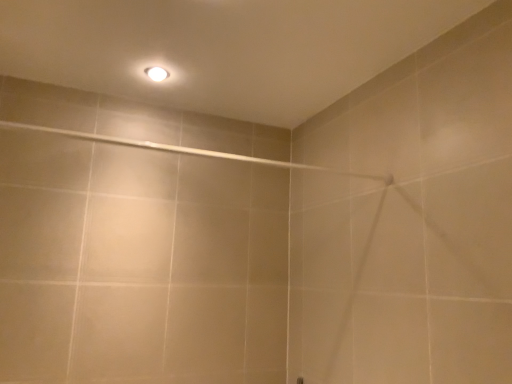
Question: Is white glossy light bulb at upper center closer to the viewer compared to beige ceramic shower at upper center?

Choices:
 (A) no
 (B) yes

Answer: (A)

Question: Considering the relative sizes of white glossy light bulb at upper center and beige ceramic shower at upper center in the image provided, is white glossy light bulb at upper center thinner than beige ceramic shower at upper center?

Choices:
 (A) yes
 (B) no

Answer: (B)

Question: Does white glossy light bulb at upper center have a greater width compared to beige ceramic shower at upper center?

Choices:
 (A) yes
 (B) no

Answer: (A)

Question: Is beige ceramic shower at upper center located within white glossy light bulb at upper center?

Choices:
 (A) yes
 (B) no

Answer: (B)

Question: Is white glossy light bulb at upper center smaller than beige ceramic shower at upper center?

Choices:
 (A) yes
 (B) no

Answer: (A)

Question: Is white glossy light bulb at upper center at the right side of beige ceramic shower at upper center?

Choices:
 (A) no
 (B) yes

Answer: (A)

Question: Is beige ceramic shower at upper center at the left side of white glossy light bulb at upper center?

Choices:
 (A) yes
 (B) no

Answer: (B)

Question: From a real-world perspective, is beige ceramic shower at upper center positioned over white glossy light bulb at upper center based on gravity?

Choices:
 (A) yes
 (B) no

Answer: (B)

Question: Is beige ceramic shower at upper center thinner than white glossy light bulb at upper center?

Choices:
 (A) no
 (B) yes

Answer: (B)

Question: Considering the relative positions of beige ceramic shower at upper center and white glossy light bulb at upper center in the image provided, is beige ceramic shower at upper center in front of white glossy light bulb at upper center?

Choices:
 (A) yes
 (B) no

Answer: (A)

Question: Does beige ceramic shower at upper center come behind white glossy light bulb at upper center?

Choices:
 (A) no
 (B) yes

Answer: (A)

Question: Is beige ceramic shower at upper center outside of white glossy light bulb at upper center?

Choices:
 (A) yes
 (B) no

Answer: (A)

Question: Considering the positions of point (154, 76) and point (140, 142), is point (154, 76) closer or farther from the camera than point (140, 142)?

Choices:
 (A) farther
 (B) closer

Answer: (B)